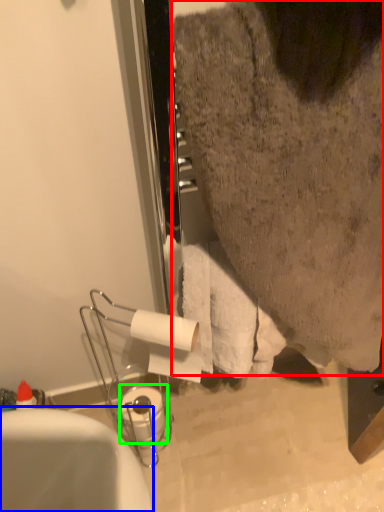
Question: Which is farther away from person (highlighted by a red box)? bathtub (highlighted by a blue box) or toilet paper (highlighted by a green box)?

Choices:
 (A) bathtub
 (B) toilet paper

Answer: (B)